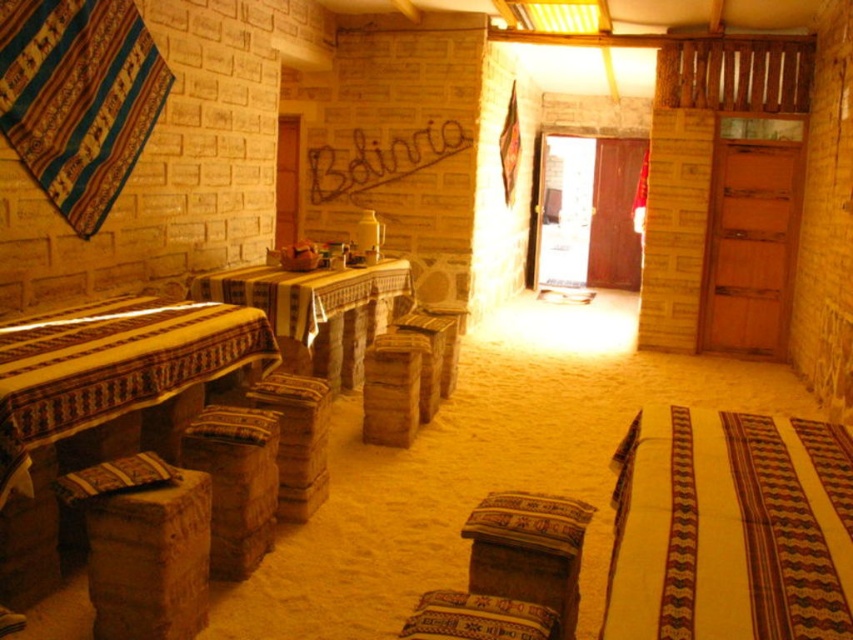
You are a customer sitting at the table on the left side of the room. You want to grab the striped cotton blanket at lower right to keep warm. Can you reach it from your current position?

The striped cotton blanket at lower right is located at point (730, 528), which is far from the table on the left side. You cannot reach it from your current position.

You are sitting at a table in the rustic, warmly lit interior space. You want to grab the striped cotton blanket at lower right to wrap yourself in. Is the rustic woven stool at center blocking your direct path to the blanket?

The striped cotton blanket at lower right is closer to the viewer than rustic woven stool at center, so the rustic woven stool at center is further away. Therefore, the rustic woven stool at center is not blocking your path to the striped cotton blanket at lower right.

You are a customer in this rustic interior space and need to sit down. You see a textured woven stool at lower center and a wooden stool at center. Which stool would you choose if you prefer a lower seat height?

The textured woven stool at lower center is shorter than the wooden stool at center, so it would be the better choice for a lower seat height.